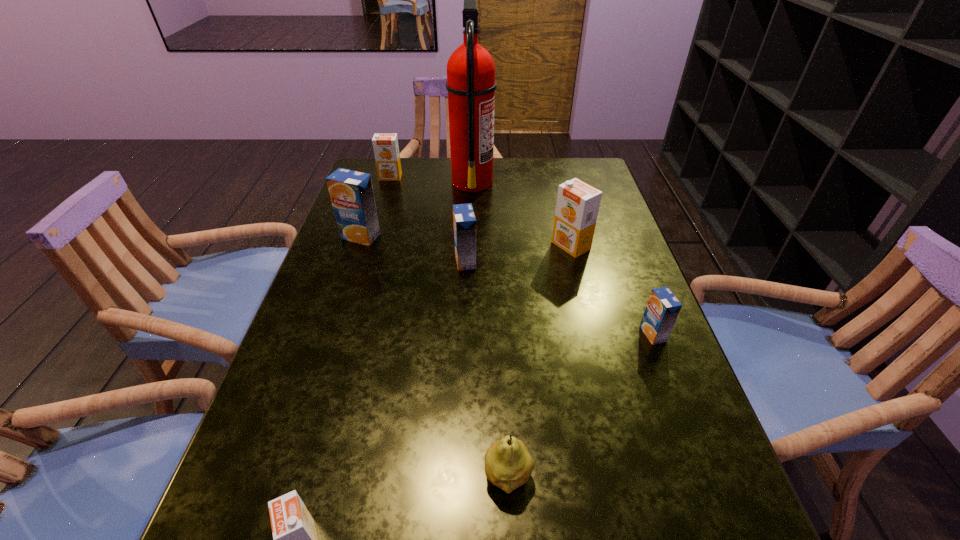
You are a GUI agent. You are given a task and a screenshot of the screen. Output one action in this format:
    pyautogui.click(x=<x>, y=<y>)
    Task: Click on the second closest object to the nearest blue orange_juice
    The image size is (960, 540).
    Given the screenshot: What is the action you would take?
    pyautogui.click(x=508, y=465)

Select which object is the seventh closest to the fire extinguisher. Please provide its 2D coordinates. Your answer should be formatted as a tuple, i.e. [(x, y)], where the tuple contains the x and y coordinates of a point satisfying the conditions above.

[(295, 539)]

Identify which orange juice is located as the fifth nearest to the nearest orange juice. Please provide its 2D coordinates. Your answer should be formatted as a tuple, i.e. [(x, y)], where the tuple contains the x and y coordinates of a point satisfying the conditions above.

[(386, 150)]

Locate an element on the screen. Image resolution: width=960 pixels, height=540 pixels. the third closest orange juice to the farthest orange orange juice is located at coordinates (577, 207).

At what (x,y) coordinates should I click in order to perform the action: click on blue orange_juice that can be found as the closest to the second smallest blue orange_juice. Please return your answer as a coordinate pair (x, y). Looking at the image, I should click on pos(351,192).

Locate which blue orange_juice ranks third in proximity to the fire extinguisher. Please provide its 2D coordinates. Your answer should be formatted as a tuple, i.e. [(x, y)], where the tuple contains the x and y coordinates of a point satisfying the conditions above.

[(663, 307)]

The image size is (960, 540). Identify the location of the third closest orange orange juice to the tallest object. (295, 539).

Identify which orange orange juice is the third nearest to the nearest blue orange_juice. Please provide its 2D coordinates. Your answer should be formatted as a tuple, i.e. [(x, y)], where the tuple contains the x and y coordinates of a point satisfying the conditions above.

[(386, 150)]

Identify the location of vacant space that satisfies the following two spatial constraints: 1. on the side of the fire extinguisher near the handle; 2. on the left side of the rightmost orange orange juice. The image size is (960, 540). (470, 246).

The image size is (960, 540). What are the coordinates of `free space that satisfies the following two spatial constraints: 1. on the side of the pear near the handle; 2. on the left side of the fire extinguisher` in the screenshot? It's located at (465, 476).